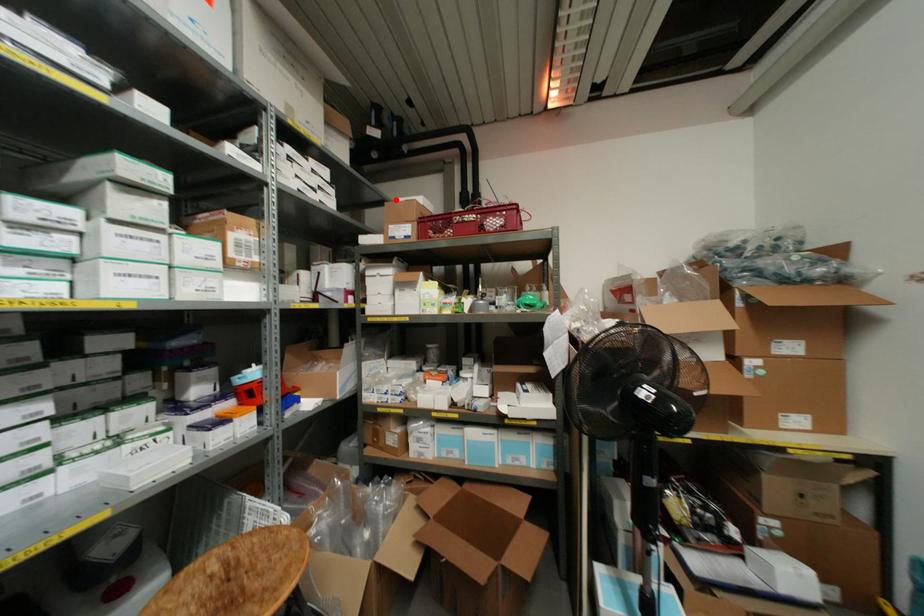
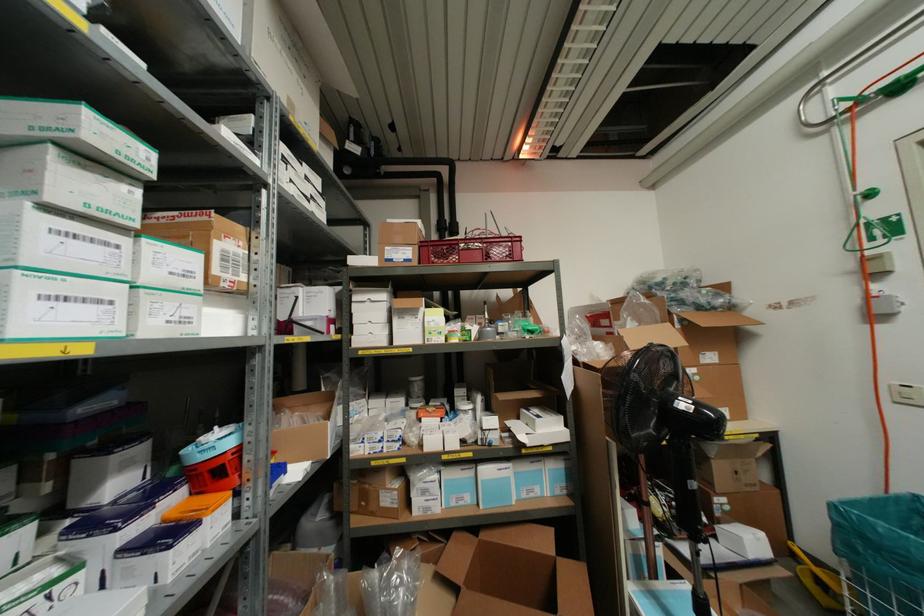
In the second image, find the point that corresponds to the highlighted location in the first image.

(388, 220)